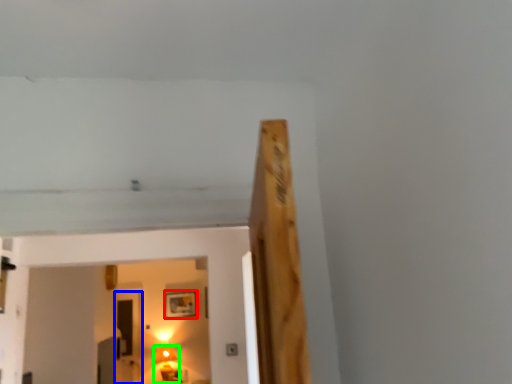
Question: Estimate the real-world distances between objects in this image. Which object is farther from picture frame (highlighted by a red box), glass door (highlighted by a blue box) or lamp (highlighted by a green box)?

Choices:
 (A) glass door
 (B) lamp

Answer: (A)